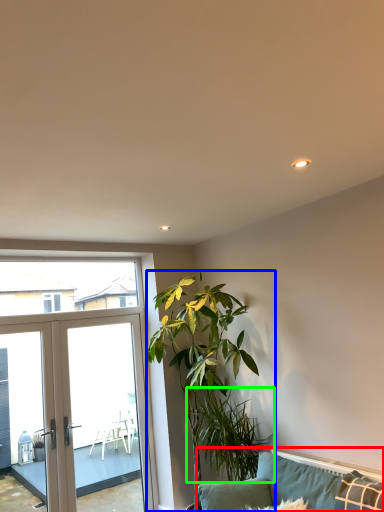
Question: Considering the real-world distances, which object is farthest from studio couch (highlighted by a red box)? houseplant (highlighted by a blue box) or plant (highlighted by a green box)?

Choices:
 (A) houseplant
 (B) plant

Answer: (A)